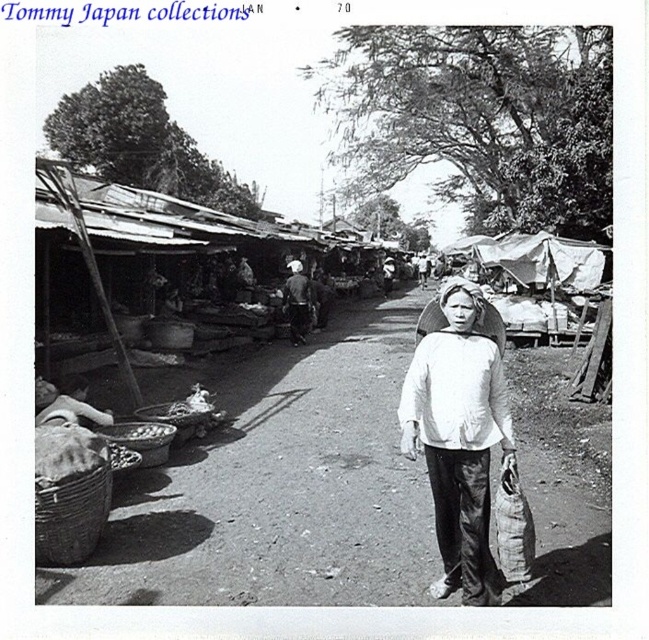
Question: Considering the relative positions of white fabric bag at center and white cotton shirt at center in the image provided, where is white fabric bag at center located with respect to white cotton shirt at center?

Choices:
 (A) right
 (B) left

Answer: (A)

Question: Is white fabric bag at center wider than dark gray fabric bag at center?

Choices:
 (A) yes
 (B) no

Answer: (A)

Question: Estimate the real-world distances between objects in this image. Which object is closer to the white cotton shirt at center?

Choices:
 (A) dark gray fabric bag at center
 (B) white fabric bag at center

Answer: (B)

Question: Based on their relative distances, which object is farther from the dark gray fabric bag at center?

Choices:
 (A) white cotton shirt at center
 (B) white fabric bag at center

Answer: (A)

Question: Among these points, which one is farthest from the camera?

Choices:
 (A) (478, 570)
 (B) (134, 509)
 (C) (284, 300)

Answer: (C)

Question: In this image, where is white fabric bag at center located relative to white cotton shirt at center?

Choices:
 (A) right
 (B) left

Answer: (A)